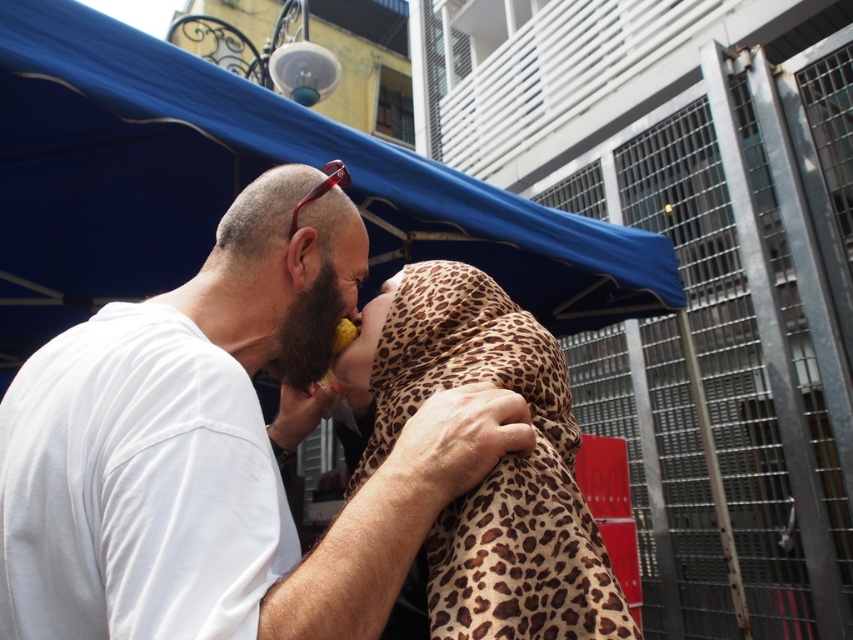
You are designing a layout for a magazine spread. The white matte shirt at center and the blue fabric canopy at upper center are key elements. Based on their spatial relationship, which element should you prioritize in terms of size to maintain visual balance?

The blue fabric canopy at upper center should be prioritized in size since it occupies more space than the white matte shirt at center, ensuring visual balance by emphasizing its dominance in the composition.

You are designing a new outfit and need to compare the thickness of the white matte shirt at center and the blue fabric canopy at upper center. Which one is thinner?

The white matte shirt at center is thinner than the blue fabric canopy at upper center according to the description.

You are a photographer standing at point [274,280]. You want to take a photo of the two people under the blue canopy. Considering their current distance, will you need to zoom in or out to frame them both clearly in the shot?

The two people are 37.81 inches apart. To frame both clearly, you should zoom out to capture the entire distance between them.